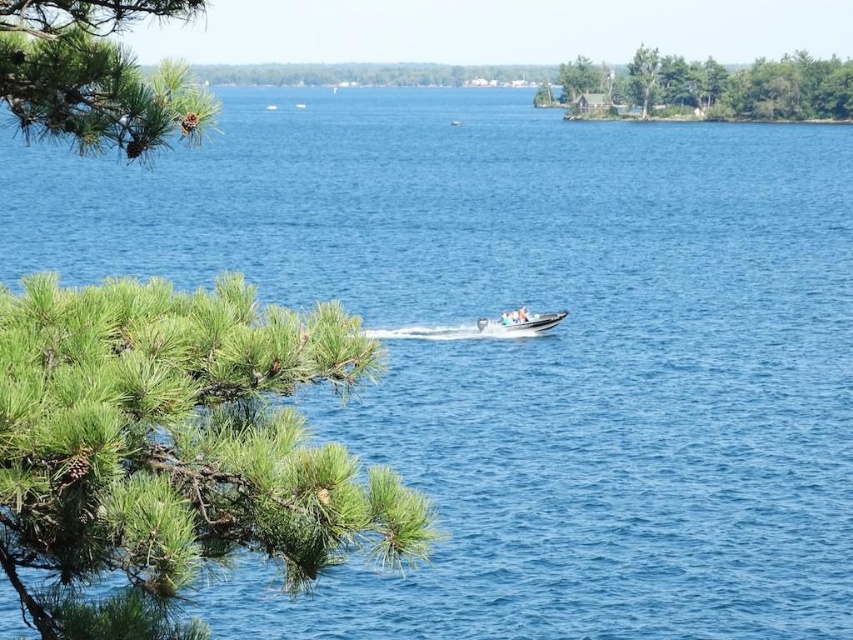
Is the position of green leafy trees at upper right less distant than that of green matte tree at upper center?

Yes.

Between green leafy trees at upper right and green matte tree at upper center, which one is positioned higher?

green matte tree at upper center is above.

Find the location of a particular element. The image size is (853, 640). green leafy trees at upper right is located at coordinates (721, 86).

You are a GUI agent. You are given a task and a screenshot of the screen. Output one action in this format:
    pyautogui.click(x=<x>, y=<y>)
    Task: Click on the green leafy trees at upper right
    The image size is (853, 640).
    Given the screenshot: What is the action you would take?
    pyautogui.click(x=721, y=86)

Is green leafy trees at upper right taller than white plastic boat at center?

Yes.

Looking at this image, who is higher up, green leafy trees at upper right or white plastic boat at center?

green leafy trees at upper right is higher up.

Is point (699, 109) positioned before point (544, 330)?

No, (699, 109) is behind (544, 330).

This screenshot has width=853, height=640. In order to click on green leafy trees at upper right in this screenshot , I will do `click(721, 86)`.

Can you confirm if green needle-like leaves at left is positioned below white plastic boat at center?

Yes, green needle-like leaves at left is below white plastic boat at center.

Who is shorter, green needle-like leaves at left or white plastic boat at center?

white plastic boat at center is shorter.

The image size is (853, 640). Describe the element at coordinates (173, 449) in the screenshot. I see `green needle-like leaves at left` at that location.

Identify the location of green needle-like leaves at left. (173, 449).